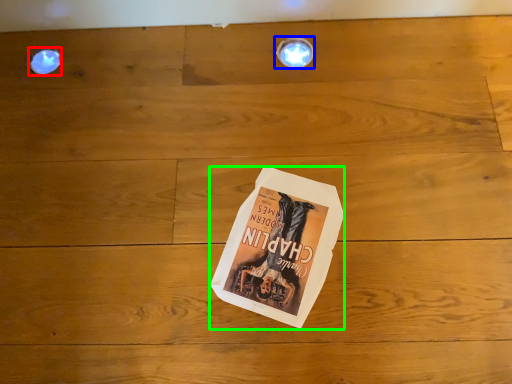
Question: Estimate the real-world distances between objects in this image. Which object is closer to droplight (highlighted by a red box), light fixture (highlighted by a blue box) or paperback book (highlighted by a green box)?

Choices:
 (A) light fixture
 (B) paperback book

Answer: (A)